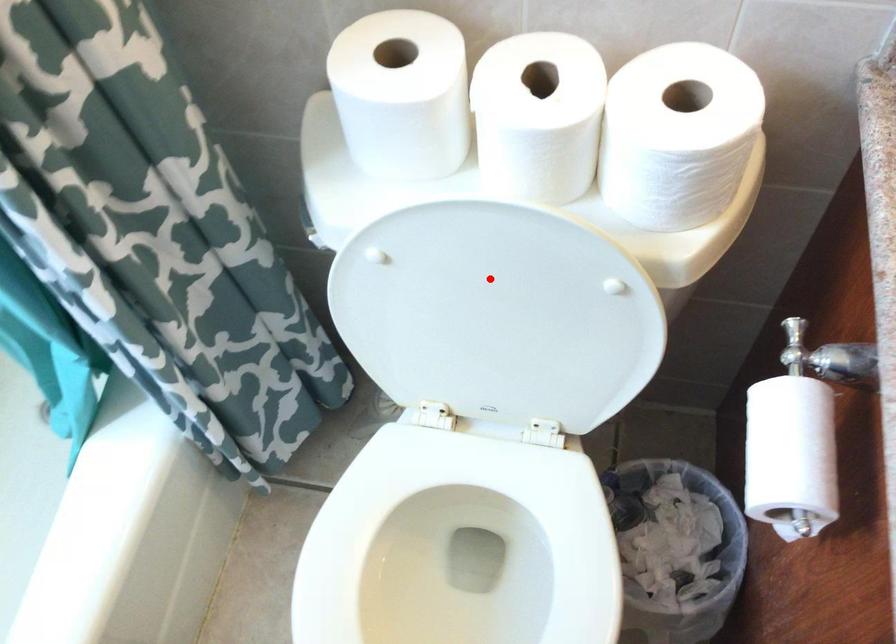
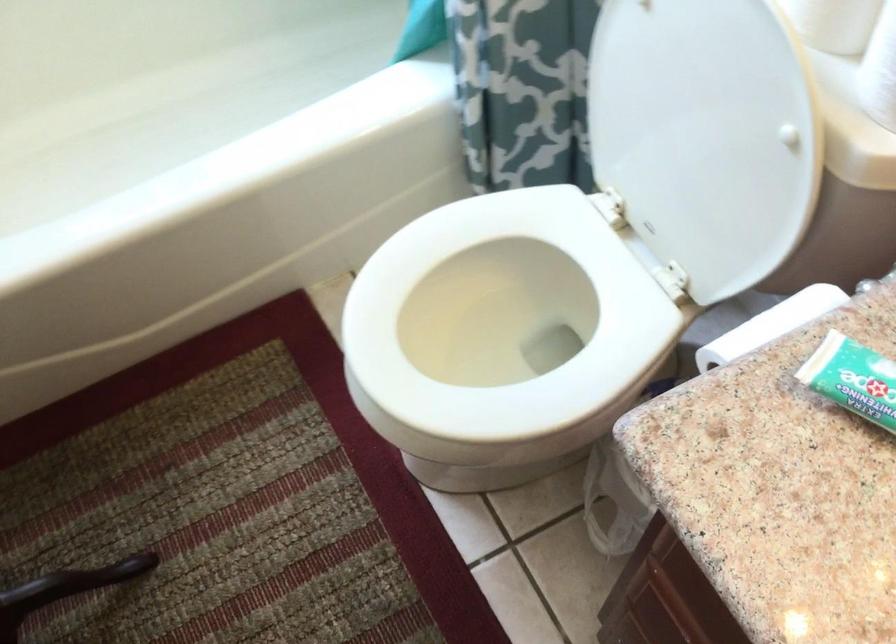
In the second image, find the point that corresponds to the highlighted location in the first image.

(708, 71)